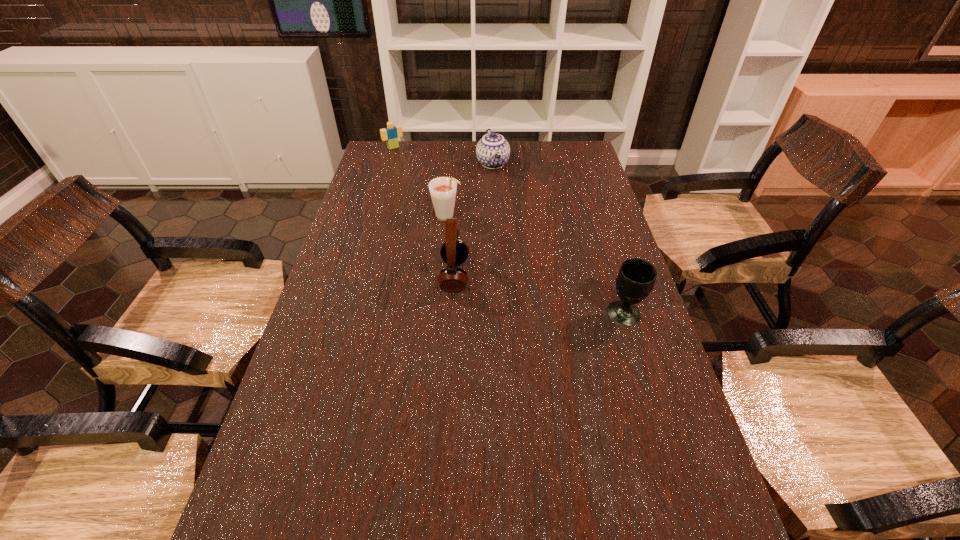
The image size is (960, 540). In order to click on vacant spot on the desktop that is between the headset and the nearest object and is positioned at the spout of the chinaware in this screenshot , I will do `click(546, 296)`.

This screenshot has height=540, width=960. What are the coordinates of `free space on the desktop that is between the headset and the nearest object and is positioned on the drink side of the root beer` in the screenshot? It's located at (539, 295).

You are a GUI agent. You are given a task and a screenshot of the screen. Output one action in this format:
    pyautogui.click(x=<x>, y=<y>)
    Task: Click on the free space on the desktop that is between the headset and the nearest object and is positioned on the face of the Lego
    The image size is (960, 540).
    Given the screenshot: What is the action you would take?
    pyautogui.click(x=527, y=292)